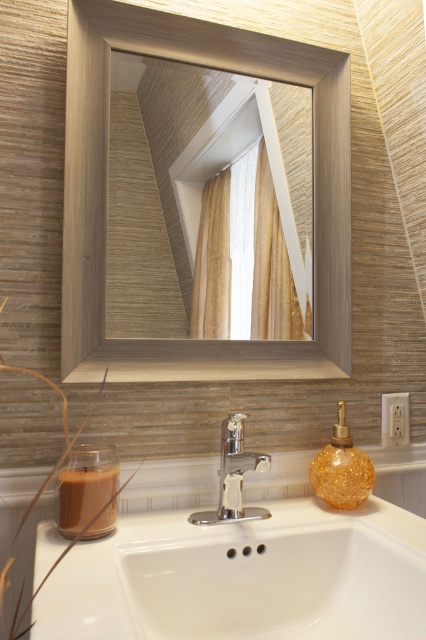
Does white textured curtain at upper center have a larger size compared to polished chrome faucet at center?

Indeed, white textured curtain at upper center has a larger size compared to polished chrome faucet at center.

Who is lower down, white textured curtain at upper center or polished chrome faucet at center?

polished chrome faucet at center is lower down.

Is point (256, 323) farther from viewer compared to point (227, 435)?

Yes, point (256, 323) is behind point (227, 435).

You are a GUI agent. You are given a task and a screenshot of the screen. Output one action in this format:
    pyautogui.click(x=<x>, y=<y>)
    Task: Click on the white textured curtain at upper center
    The height and width of the screenshot is (640, 426).
    Given the screenshot: What is the action you would take?
    pyautogui.click(x=271, y=266)

Does matte wood mirror at upper center have a lesser width compared to white ceramic sink at center?

Indeed, matte wood mirror at upper center has a lesser width compared to white ceramic sink at center.

Which is above, matte wood mirror at upper center or white ceramic sink at center?

matte wood mirror at upper center is higher up.

Does point (196, 204) come farther from viewer compared to point (362, 620)?

Yes, it is.

The height and width of the screenshot is (640, 426). In order to click on matte wood mirror at upper center in this screenshot , I will do `click(210, 200)`.

Can you confirm if white ceramic sink at center is shorter than white textured curtain at upper center?

Correct, white ceramic sink at center is not as tall as white textured curtain at upper center.

Identify the location of white ceramic sink at center. Image resolution: width=426 pixels, height=640 pixels. (244, 577).